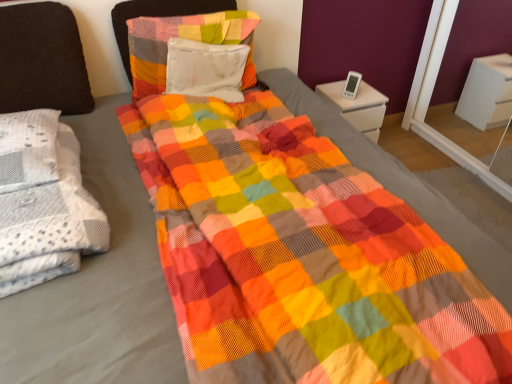
Question: Are textured cotton pillow at upper center, which is counted as the second pillow, starting from the left, and dark brown fabric pillow at left, which ranks as the 3th pillow in right-to-left order, making contact?

Choices:
 (A) no
 (B) yes

Answer: (A)

Question: Does textured cotton pillow at upper center, arranged as the second pillow when viewed from the right, have a lesser width compared to dark brown fabric pillow at left, which ranks as the 3th pillow in right-to-left order?

Choices:
 (A) yes
 (B) no

Answer: (B)

Question: Considering the relative sizes of textured cotton pillow at upper center, which is counted as the second pillow, starting from the left, and dark brown fabric pillow at left, acting as the first pillow starting from the left, in the image provided, is textured cotton pillow at upper center, which is counted as the second pillow, starting from the left, bigger than dark brown fabric pillow at left, acting as the first pillow starting from the left,?

Choices:
 (A) yes
 (B) no

Answer: (B)

Question: Does textured cotton pillow at upper center, arranged as the second pillow when viewed from the right, appear on the left side of dark brown fabric pillow at left, which ranks as the 3th pillow in right-to-left order?

Choices:
 (A) no
 (B) yes

Answer: (A)

Question: Are textured cotton pillow at upper center, arranged as the second pillow when viewed from the right, and dark brown fabric pillow at left, which ranks as the 3th pillow in right-to-left order, far apart?

Choices:
 (A) no
 (B) yes

Answer: (A)

Question: Considering the relative positions of textured cotton pillow at upper center, arranged as the second pillow when viewed from the right, and dark brown fabric pillow at left, acting as the first pillow starting from the left, in the image provided, is textured cotton pillow at upper center, arranged as the second pillow when viewed from the right, behind dark brown fabric pillow at left, acting as the first pillow starting from the left,?

Choices:
 (A) no
 (B) yes

Answer: (B)

Question: Is white glossy nightstand at upper right surrounded by textured cotton pillow at upper center, arranged as the second pillow when viewed from the right?

Choices:
 (A) no
 (B) yes

Answer: (A)

Question: Is textured cotton pillow at upper center, which is counted as the second pillow, starting from the left, oriented towards white glossy nightstand at upper right?

Choices:
 (A) no
 (B) yes

Answer: (A)

Question: Considering the relative sizes of textured cotton pillow at upper center, which is counted as the second pillow, starting from the left, and white glossy nightstand at upper right in the image provided, is textured cotton pillow at upper center, which is counted as the second pillow, starting from the left, thinner than white glossy nightstand at upper right?

Choices:
 (A) no
 (B) yes

Answer: (B)

Question: From a real-world perspective, does textured cotton pillow at upper center, which is counted as the second pillow, starting from the left, stand above white glossy nightstand at upper right?

Choices:
 (A) no
 (B) yes

Answer: (B)

Question: Does textured cotton pillow at upper center, which is counted as the second pillow, starting from the left, lie in front of white glossy nightstand at upper right?

Choices:
 (A) no
 (B) yes

Answer: (B)

Question: Is textured cotton pillow at upper center, arranged as the second pillow when viewed from the right, not close to white glossy nightstand at upper right?

Choices:
 (A) yes
 (B) no

Answer: (B)

Question: Is white glossy nightstand at upper right to the left of white textured blanket at left from the viewer's perspective?

Choices:
 (A) no
 (B) yes

Answer: (A)